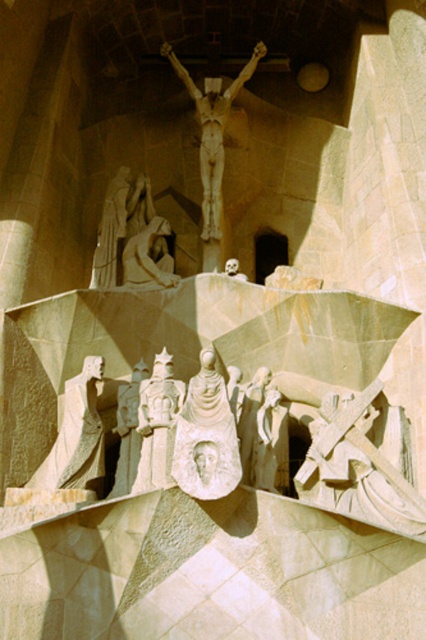
Does smooth beige statue at lower left appear on the left side of matte stone statue at center?

Yes, smooth beige statue at lower left is to the left of matte stone statue at center.

Does smooth beige statue at lower left have a smaller size compared to matte stone statue at center?

Actually, smooth beige statue at lower left might be larger than matte stone statue at center.

Between point (65, 449) and point (275, 464), which one is positioned in front?

Point (275, 464) is more forward.

Find the location of a particular element. The height and width of the screenshot is (640, 426). smooth beige statue at lower left is located at coordinates (75, 435).

Is carved stone cross at lower right taller than smooth beige statue at lower left?

In fact, carved stone cross at lower right may be shorter than smooth beige statue at lower left.

Does carved stone cross at lower right have a greater width compared to smooth beige statue at lower left?

Indeed, carved stone cross at lower right has a greater width compared to smooth beige statue at lower left.

You are a GUI agent. You are given a task and a screenshot of the screen. Output one action in this format:
    pyautogui.click(x=<x>, y=<y>)
    Task: Click on the carved stone cross at lower right
    
    Given the screenshot: What is the action you would take?
    pyautogui.click(x=356, y=468)

Is carved stone cross at lower right bigger than matte stone statue at center?

Correct, carved stone cross at lower right is larger in size than matte stone statue at center.

Does point (371, 444) come behind point (284, 417)?

No.

Between point (400, 486) and point (267, 432), which one is positioned behind?

Point (267, 432)

Image resolution: width=426 pixels, height=640 pixels. Identify the location of carved stone cross at lower right. (356, 468).